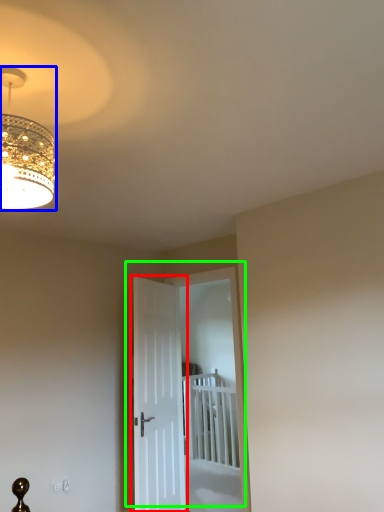
Question: Estimate the real-world distances between objects in this image. Which object is farther from door (highlighted by a red box), lamp (highlighted by a blue box) or door (highlighted by a green box)?

Choices:
 (A) lamp
 (B) door

Answer: (B)